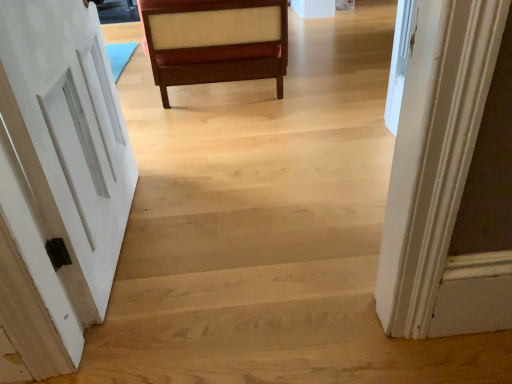
Question: Does mahogany wood chair at center have a larger size compared to white painted wood door at left?

Choices:
 (A) no
 (B) yes

Answer: (B)

Question: Is mahogany wood chair at center located outside white painted wood door at left?

Choices:
 (A) no
 (B) yes

Answer: (B)

Question: From a real-world perspective, is mahogany wood chair at center over white painted wood door at left?

Choices:
 (A) yes
 (B) no

Answer: (B)

Question: Considering the relative positions of mahogany wood chair at center and white painted wood door at left in the image provided, is mahogany wood chair at center to the left of white painted wood door at left from the viewer's perspective?

Choices:
 (A) yes
 (B) no

Answer: (B)

Question: From a real-world perspective, is mahogany wood chair at center beneath white painted wood door at left?

Choices:
 (A) no
 (B) yes

Answer: (B)

Question: Is mahogany wood chair at center far away from white painted wood door at left?

Choices:
 (A) no
 (B) yes

Answer: (A)

Question: Does white painted wood door at left have a lesser width compared to mahogany wood chair at center?

Choices:
 (A) no
 (B) yes

Answer: (B)

Question: Can you confirm if white painted wood door at left is smaller than mahogany wood chair at center?

Choices:
 (A) yes
 (B) no

Answer: (A)

Question: Is white painted wood door at left bigger than mahogany wood chair at center?

Choices:
 (A) no
 (B) yes

Answer: (A)

Question: Are white painted wood door at left and mahogany wood chair at center far apart?

Choices:
 (A) yes
 (B) no

Answer: (B)

Question: Can you confirm if white painted wood door at left is positioned to the left of mahogany wood chair at center?

Choices:
 (A) yes
 (B) no

Answer: (A)

Question: Is white painted wood door at left located outside mahogany wood chair at center?

Choices:
 (A) yes
 (B) no

Answer: (A)

Question: Considering the positions of white painted wood door at left and mahogany wood chair at center in the image, is white painted wood door at left taller or shorter than mahogany wood chair at center?

Choices:
 (A) short
 (B) tall

Answer: (B)